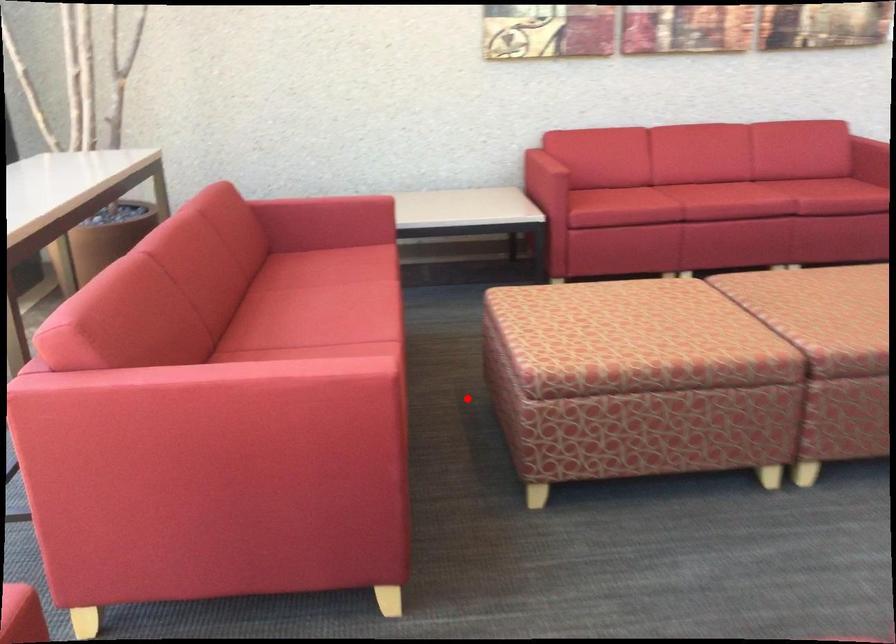
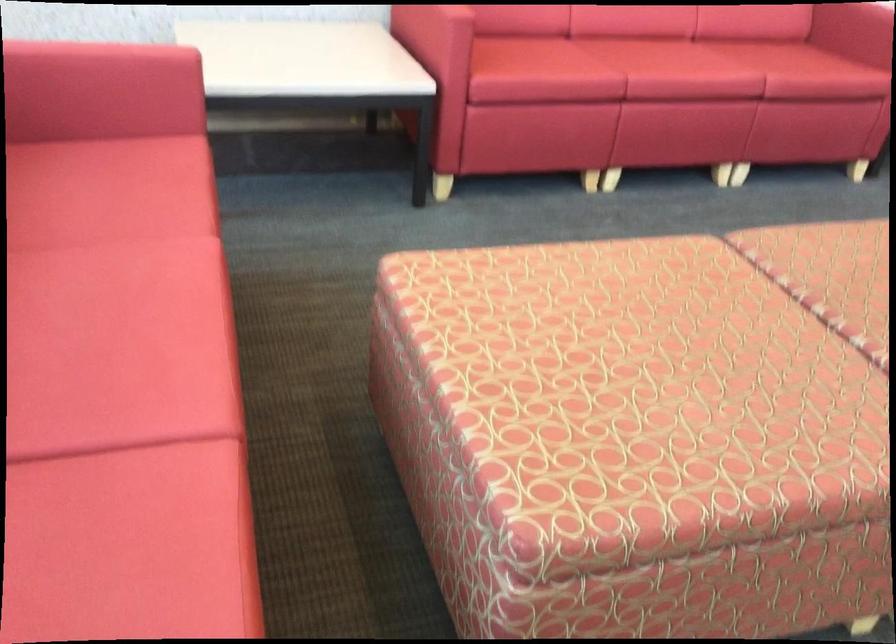
Where in the second image is the point corresponding to the highlighted location from the first image?

(333, 424)